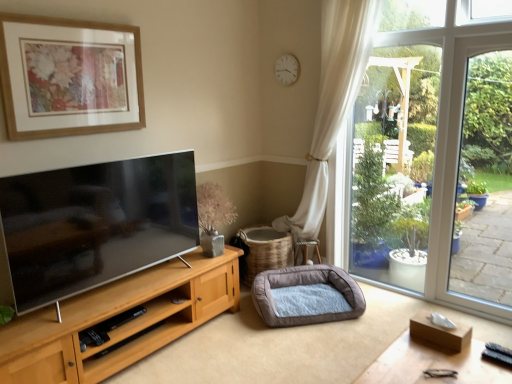
The width and height of the screenshot is (512, 384). What do you see at coordinates (263, 251) in the screenshot?
I see `beige woven basket at center` at bounding box center [263, 251].

Locate an element on the screen. beige woven basket at center is located at coordinates (263, 251).

Measure the distance between point (65, 128) and camera.

They are 2.51 meters apart.

What is the approximate width of wooden table at lower right?

wooden table at lower right is 19.93 inches wide.

At what (x,y) coordinates should I click in order to perform the action: click on beige woven basket at center. Please return your answer as a coordinate pair (x, y). The width and height of the screenshot is (512, 384). Looking at the image, I should click on (263, 251).

Is beige woven basket at center surrounded by wooden picture frame at upper left?

Actually, beige woven basket at center is outside wooden picture frame at upper left.

Considering the sizes of wooden picture frame at upper left and beige woven basket at center in the image, is wooden picture frame at upper left bigger or smaller than beige woven basket at center?

Clearly, wooden picture frame at upper left is smaller in size than beige woven basket at center.

From the image's perspective, which object appears higher, wooden picture frame at upper left or beige woven basket at center?

From the image's view, wooden picture frame at upper left is above.

This screenshot has height=384, width=512. I want to click on picture frame above the beige woven basket at center (from a real-world perspective), so tap(69, 77).

Locate an element on the screen. This screenshot has width=512, height=384. table on the right of beige woven basket at center is located at coordinates (432, 364).

From a real-world perspective, is wooden table at lower right on beige woven basket at center?

Yes, from a real-world perspective, wooden table at lower right is above beige woven basket at center.

Would you say wooden table at lower right is to the left or to the right of beige woven basket at center in the picture?

wooden table at lower right is to the right of beige woven basket at center.

Considering the sizes of wooden table at lower right and beige woven basket at center in the image, is wooden table at lower right taller or shorter than beige woven basket at center?

wooden table at lower right is shorter than beige woven basket at center.

How distant is white plastic clock at upper center from beige woven basket at center?

white plastic clock at upper center and beige woven basket at center are 1.44 meters apart.

From the image's perspective, is white plastic clock at upper center on top of beige woven basket at center?

Yes, from the image's perspective, white plastic clock at upper center is on top of beige woven basket at center.

Does white plastic clock at upper center have a greater height compared to beige woven basket at center?

No, white plastic clock at upper center is not taller than beige woven basket at center.

Could you tell me if white plastic clock at upper center is turned towards beige woven basket at center?

No, white plastic clock at upper center does not turn towards beige woven basket at center.

Is beige woven basket at center looking in the opposite direction of wooden picture frame at upper left?

No, beige woven basket at center is not facing away from wooden picture frame at upper left.

Which object is wider, beige woven basket at center or wooden picture frame at upper left?

beige woven basket at center is wider.

From a real-world perspective, is beige woven basket at center above or below wooden picture frame at upper left?

beige woven basket at center is situated lower than wooden picture frame at upper left in the real world.

How distant is beige woven basket at center from wooden picture frame at upper left?

1.62 meters.

Looking at this image, in terms of height, does wooden picture frame at upper left look taller or shorter compared to soft gray fabric dog bed at lower center?

→ wooden picture frame at upper left is taller than soft gray fabric dog bed at lower center.

In the scene shown: Considering the sizes of objects wooden picture frame at upper left and soft gray fabric dog bed at lower center in the image provided, who is wider, wooden picture frame at upper left or soft gray fabric dog bed at lower center?

With larger width is soft gray fabric dog bed at lower center.

Find the location of a particular element. This screenshot has width=512, height=384. picture frame to the left of soft gray fabric dog bed at lower center is located at coordinates (x=69, y=77).

At what (x,y) coordinates should I click in order to perform the action: click on clock that appears behind the wooden picture frame at upper left. Please return your answer as a coordinate pair (x, y). This screenshot has width=512, height=384. Looking at the image, I should click on (287, 69).

From a real-world perspective, between white plastic clock at upper center and wooden picture frame at upper left, who is vertically lower?

wooden picture frame at upper left.

Which is more to the right, white plastic clock at upper center or wooden picture frame at upper left?

white plastic clock at upper center is more to the right.

From the image's perspective, which one is positioned higher, white plastic clock at upper center or wooden picture frame at upper left?

white plastic clock at upper center.

Is beige woven basket at center completely or partially inside soft gray fabric dog bed at lower center?

No, beige woven basket at center is not inside soft gray fabric dog bed at lower center.

From the image's perspective, is soft gray fabric dog bed at lower center above beige woven basket at center?

Incorrect, from the image's perspective, soft gray fabric dog bed at lower center is lower than beige woven basket at center.

At what (x,y) coordinates should I click in order to perform the action: click on dog bed located on the right of beige woven basket at center. Please return your answer as a coordinate pair (x, y). Looking at the image, I should click on (306, 294).

Is beige woven basket at center at the back of soft gray fabric dog bed at lower center?

Yes, soft gray fabric dog bed at lower center is positioned with its back facing beige woven basket at center.

Find the location of a particular element. This screenshot has width=512, height=384. picture frame lying above the beige woven basket at center (from the image's perspective) is located at coordinates (69, 77).

Identify the location of basket located underneath the wooden table at lower right (from a real-world perspective). (263, 251).

Looking at the image, which one is located further to beige woven basket at center, wooden table at lower right or white plastic clock at upper center?

The object further to beige woven basket at center is wooden table at lower right.

Looking at this image, from the image, which object appears to be nearer to beige woven basket at center, wooden table at lower right or wooden picture frame at upper left?

wooden picture frame at upper left is positioned closer to the anchor beige woven basket at center.

Estimate the real-world distances between objects in this image. Which object is further from beige woven basket at center, wooden picture frame at upper left or wooden table at lower right?

Among the two, wooden table at lower right is located further to beige woven basket at center.

Which object lies nearer to the anchor point white plastic clock at upper center, wooden picture frame at upper left or soft gray fabric dog bed at lower center?

Based on the image, wooden picture frame at upper left appears to be nearer to white plastic clock at upper center.

When comparing their distances from wooden picture frame at upper left, does beige woven basket at center or soft gray fabric dog bed at lower center seem further?

The object further to wooden picture frame at upper left is soft gray fabric dog bed at lower center.

Which object lies nearer to the anchor point wooden picture frame at upper left, soft gray fabric dog bed at lower center or white plastic clock at upper center?

white plastic clock at upper center.

Considering their positions, is beige woven basket at center positioned further to soft gray fabric dog bed at lower center than wooden table at lower right?

wooden table at lower right.

Based on the photo, when comparing their distances from beige woven basket at center, does white plastic clock at upper center or wooden picture frame at upper left seem closer?

white plastic clock at upper center lies closer to beige woven basket at center than the other object.

You are a GUI agent. You are given a task and a screenshot of the screen. Output one action in this format:
    pyautogui.click(x=<x>, y=<y>)
    Task: Click on the picture frame between white plastic clock at upper center and soft gray fabric dog bed at lower center vertically
    The width and height of the screenshot is (512, 384).
    Given the screenshot: What is the action you would take?
    pyautogui.click(x=69, y=77)

You are a GUI agent. You are given a task and a screenshot of the screen. Output one action in this format:
    pyautogui.click(x=<x>, y=<y>)
    Task: Click on the basket between wooden table at lower right and white plastic clock at upper center in the front-back direction
    
    Given the screenshot: What is the action you would take?
    pyautogui.click(x=263, y=251)

Identify the location of basket that lies between wooden picture frame at upper left and soft gray fabric dog bed at lower center from top to bottom. The image size is (512, 384). (263, 251).

Find the location of a particular element. The width and height of the screenshot is (512, 384). dog bed positioned between wooden table at lower right and beige woven basket at center from near to far is located at coordinates (306, 294).